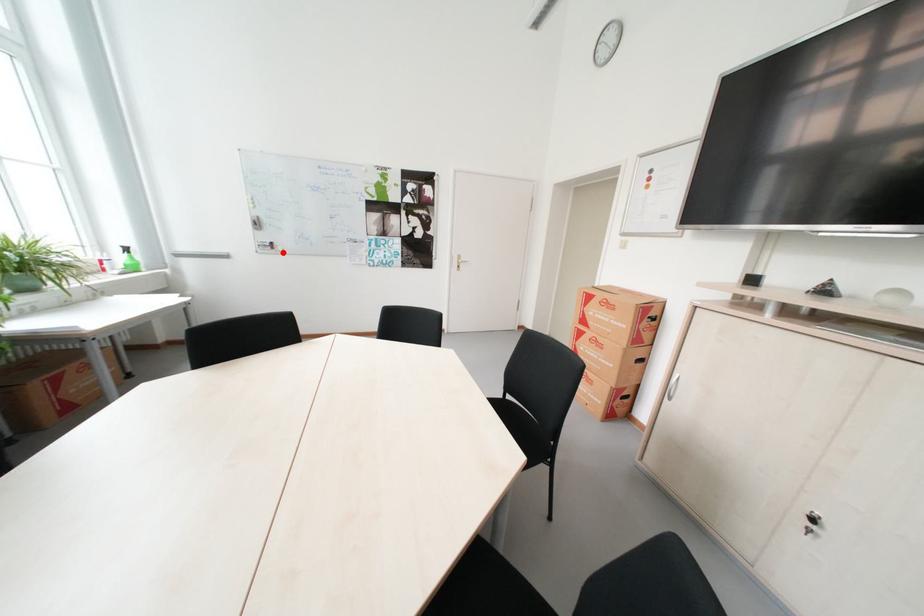
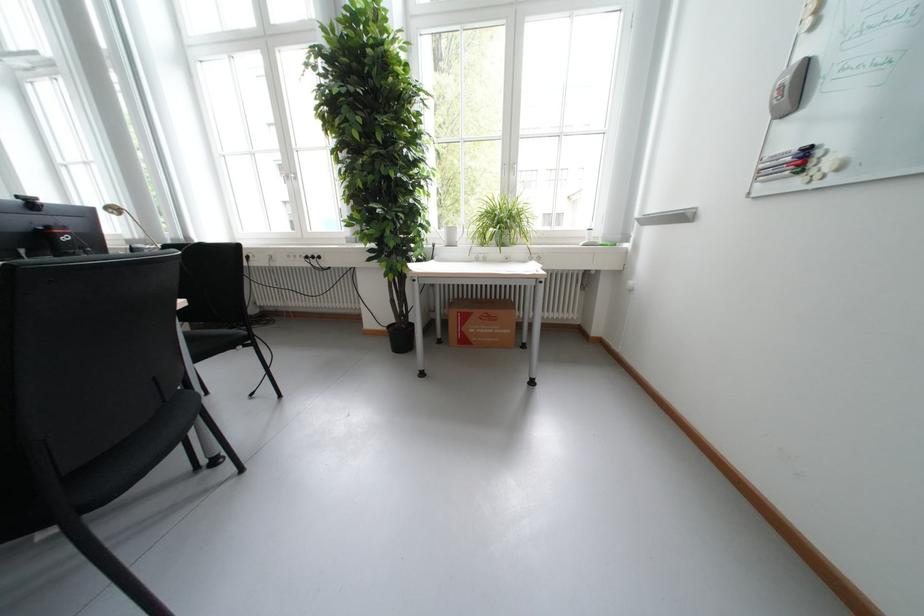
Find the pixel in the second image that matches the highlighted location in the first image.

(806, 184)